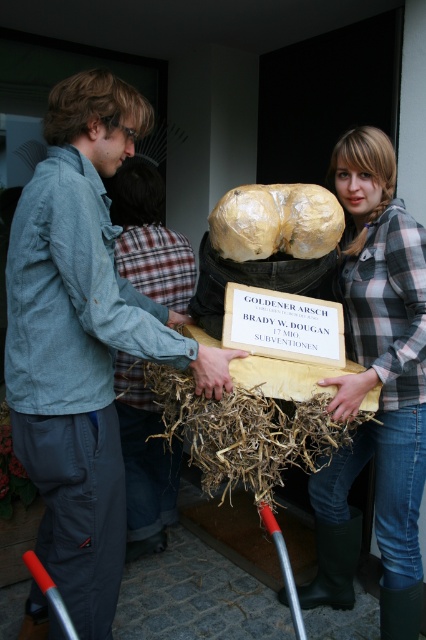
Question: Which point is farther to the camera?

Choices:
 (A) (108, 394)
 (B) (267, 243)
 (C) (259, 465)
 (D) (399, 634)

Answer: (D)

Question: Which of the following is the farthest from the observer?

Choices:
 (A) (72, 408)
 (B) (236, 216)

Answer: (B)

Question: In this image, where is light blue denim jacket at center located relative to plaid flannel shirt at center?

Choices:
 (A) right
 (B) left

Answer: (B)

Question: Can you confirm if brown fibrous hay at center is thinner than gold-brown waxed sculpture at center?

Choices:
 (A) yes
 (B) no

Answer: (B)

Question: Which point appears farthest from the camera in this image?

Choices:
 (A) (385, 346)
 (B) (241, 392)
 (C) (287, 248)
 (D) (66, 112)

Answer: (A)

Question: Is light blue denim jacket at center below gold-brown waxed sculpture at center?

Choices:
 (A) no
 (B) yes

Answer: (B)